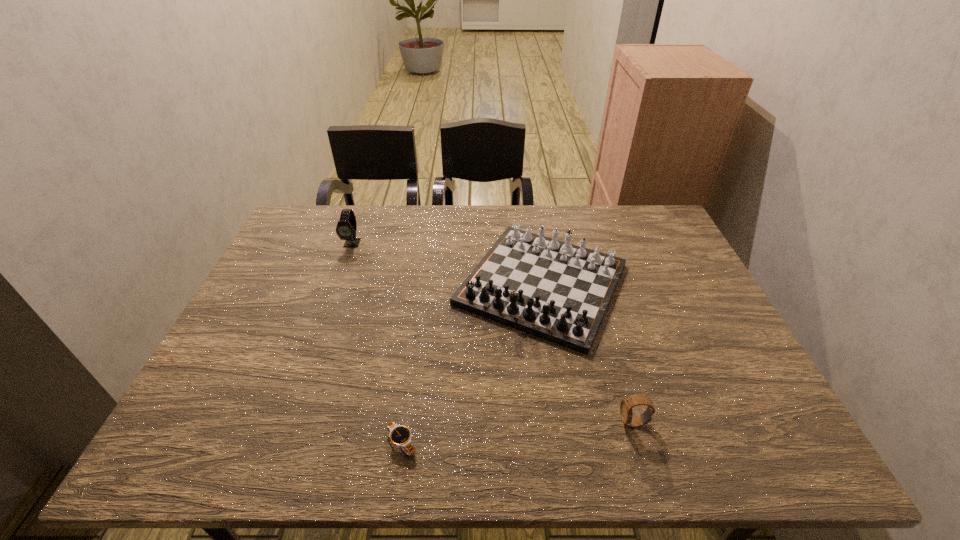
Identify the location of object that stands as the second closest to the leftmost watch. (400, 436).

The height and width of the screenshot is (540, 960). Find the location of `object that is the second closest to the tallest watch`. object that is the second closest to the tallest watch is located at coordinates coord(400,436).

At what (x,y) coordinates should I click in order to perform the action: click on watch that is the closest to the farthest watch. Please return your answer as a coordinate pair (x, y). Looking at the image, I should click on (x=400, y=436).

Locate an element on the screen. The image size is (960, 540). watch that can be found as the second closest to the second shortest watch is located at coordinates (346, 228).

Identify the location of vacant region that satisfies the following two spatial constraints: 1. on the face of the shortest object; 2. on the left side of the leftmost object. This screenshot has height=540, width=960. (280, 443).

Locate an element on the screen. The image size is (960, 540). free space that satisfies the following two spatial constraints: 1. on the face of the chessboard; 2. on the left side of the leftmost object is located at coordinates (338, 284).

Identify the location of vacant space that satisfies the following two spatial constraints: 1. on the face of the tallest object; 2. on the right side of the second watch from right to left. This screenshot has width=960, height=540. (280, 443).

The image size is (960, 540). I want to click on free spot that satisfies the following two spatial constraints: 1. on the face of the tallest watch; 2. on the right side of the chessboard, so click(338, 284).